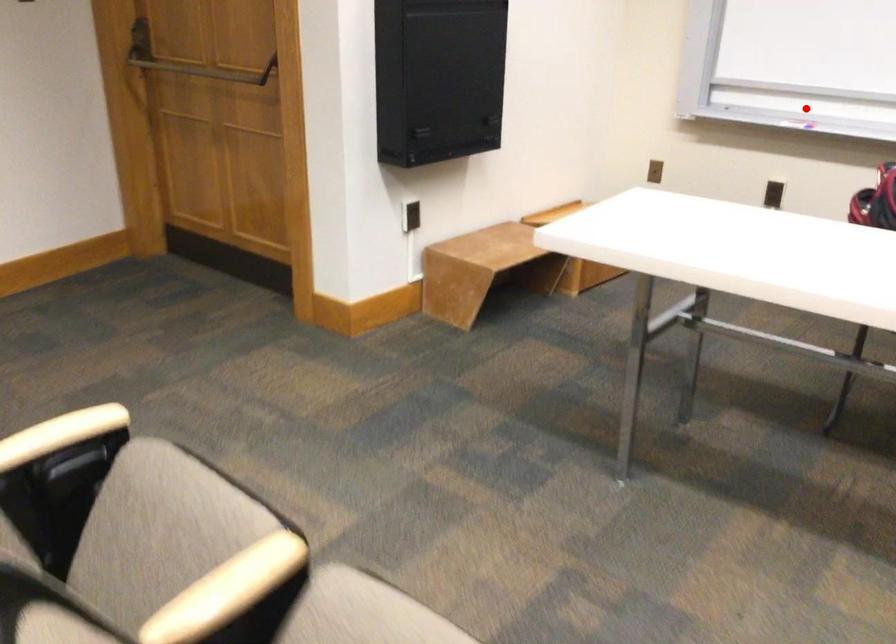
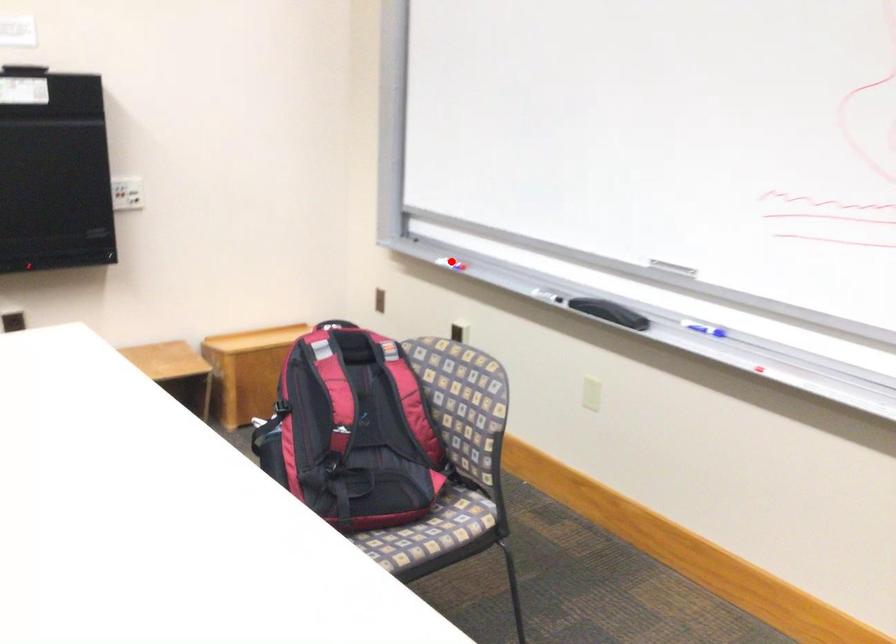
I am providing you with two images of the same scene from different viewpoints. A red point is marked on the first image and another point is marked on the second image. Does the point marked in image1 correspond to the same location as the one in image2?

Yes